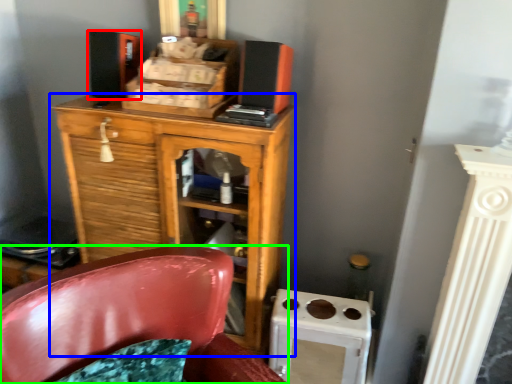
Question: Estimate the real-world distances between objects in this image. Which object is farther from speaker (highlighted by a red box), chest of drawers (highlighted by a blue box) or chair (highlighted by a green box)?

Choices:
 (A) chest of drawers
 (B) chair

Answer: (B)